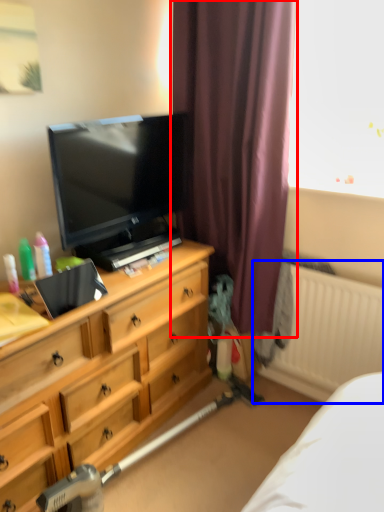
Question: Which of the following is the farthest to the observer, curtain (highlighted by a red box) or radiator (highlighted by a blue box)?

Choices:
 (A) curtain
 (B) radiator

Answer: (B)